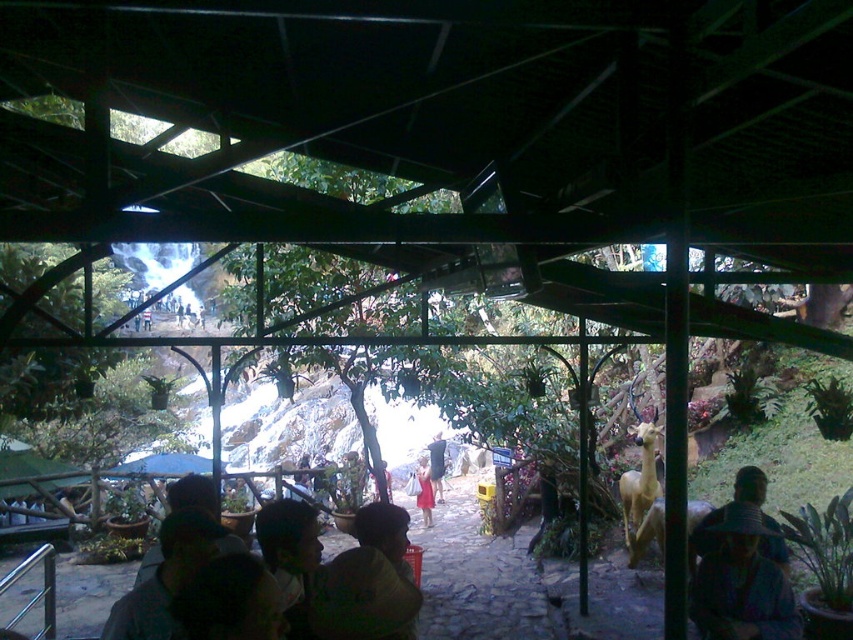
From the picture: You are standing at the covered structure and want to hand a souvenir to someone wearing the dark green fabric hat at lower center and the dark gray fabric hat at lower right. Can you give both souvenirs at the same time if you can reach 10 feet?

Answer: The dark green fabric hat at lower center and dark gray fabric hat at lower right are 9.59 feet apart. Since the distance between them is less than 10 feet, you can reach both at the same time.

You are standing under the pavilion and notice two hats on the ground. The hats are the dark green fabric hat at lower center and the dark gray fabric hat at lower right. Which hat is positioned more to the left side?

The dark green fabric hat at lower center is positioned to the left of the dark gray fabric hat at lower right, so the dark green fabric hat at lower center is more to the left.

You are standing under the dark green roofed structure and want to take a photo of the red fabric dress at center. Which direction should you move to ensure the blue fabric canopy at center is not blocking your view?

The blue fabric canopy at center is to the left of the red fabric dress at center. To avoid the canopy blocking the view, you should move to the right side of the red fabric dress at center.